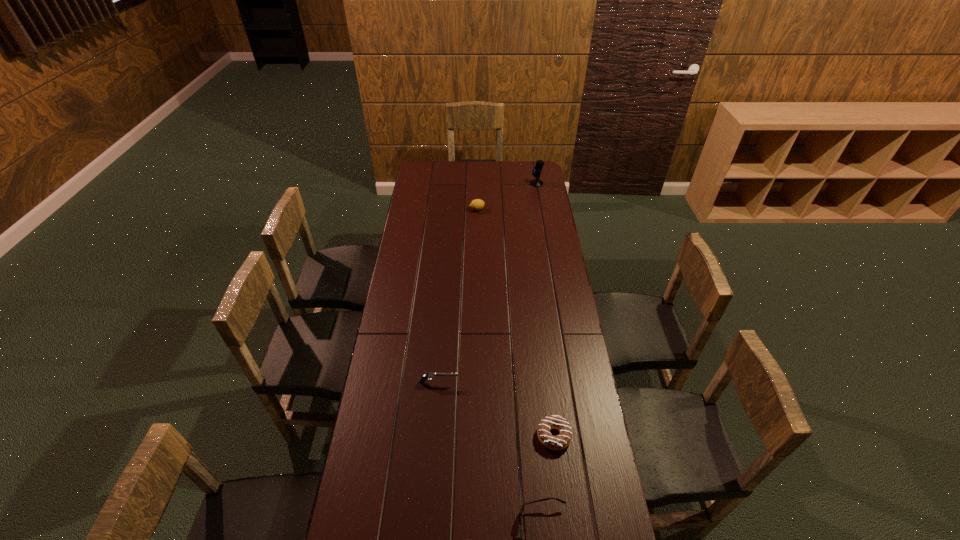
This screenshot has width=960, height=540. I want to click on vacant space located at the stem end of the fourth nearest object, so click(537, 210).

Image resolution: width=960 pixels, height=540 pixels. What are the coordinates of `vacant space positioned on the front-facing side of the third nearest object` in the screenshot? It's located at (560, 382).

Locate an element on the screen. The height and width of the screenshot is (540, 960). free space located 0.190m on the back of the fourth farthest object is located at coordinates (546, 374).

Find the location of a particular element. object that is at the far edge is located at coordinates (537, 182).

The width and height of the screenshot is (960, 540). What are the coordinates of `microphone at the right edge` in the screenshot? It's located at (537, 182).

Identify the location of doughnut located at the right edge. The image size is (960, 540). (561, 441).

Where is `object present at the far right corner`? This screenshot has height=540, width=960. object present at the far right corner is located at coordinates (537, 182).

Identify the location of vacant area at the far edge of the desktop. The image size is (960, 540). (463, 165).

This screenshot has width=960, height=540. In order to click on vacant space at the left edge of the desktop in this screenshot , I will do `click(420, 350)`.

Identify the location of vacant point at the right edge. (543, 202).